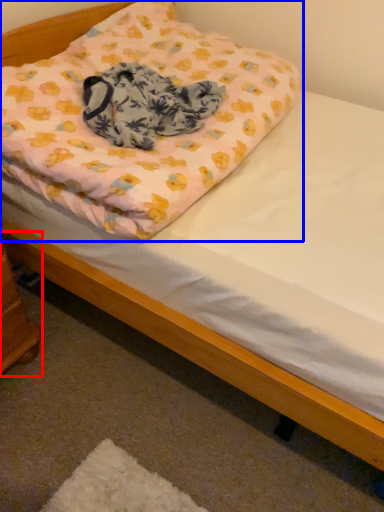
Question: Which of the following is the closest to the observer, changing table (highlighted by a red box) or pillow (highlighted by a blue box)?

Choices:
 (A) changing table
 (B) pillow

Answer: (B)